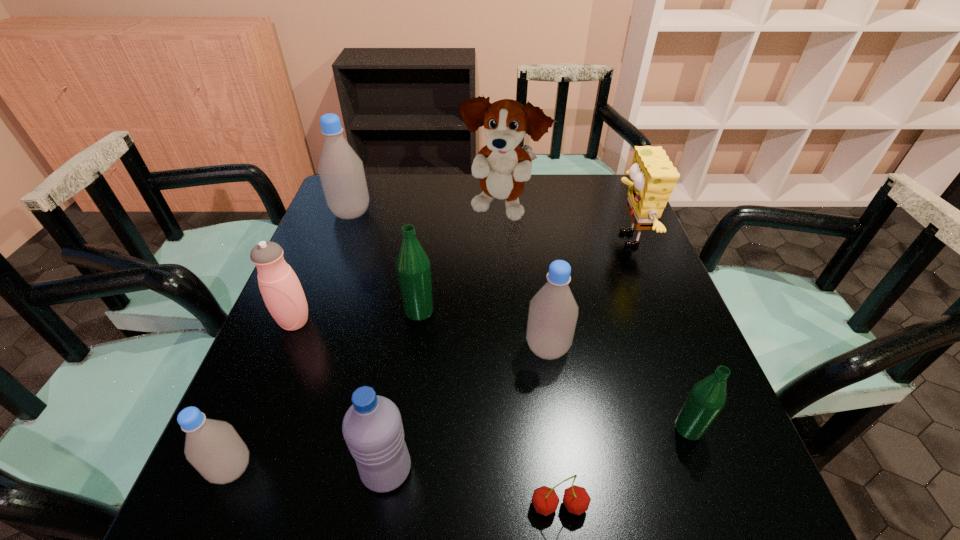
Image resolution: width=960 pixels, height=540 pixels. I want to click on vacant position at the left edge of the desktop, so click(339, 231).

Find the location of a particular element. This screenshot has width=960, height=540. free space at the right edge is located at coordinates (605, 293).

Where is `free region at the far left corner of the desktop`? free region at the far left corner of the desktop is located at coordinates (368, 182).

You are a GUI agent. You are given a task and a screenshot of the screen. Output one action in this format:
    pyautogui.click(x=<x>, y=<y>)
    Task: Click on the free space at the near left corner of the desktop
    
    Given the screenshot: What is the action you would take?
    pyautogui.click(x=214, y=524)

Find the location of a particular element. This screenshot has width=960, height=540. blank space at the far right corner is located at coordinates coord(600,176).

Find the location of `free space that is in between the seventh farthest object and the sponge`. free space that is in between the seventh farthest object and the sponge is located at coordinates (658, 334).

This screenshot has height=540, width=960. Identify the location of vacant area that lies between the biggest gray bottle and the cherry. (455, 360).

You are a GUI agent. You are given a task and a screenshot of the screen. Output one action in this format:
    pyautogui.click(x=<x>, y=<y>)
    Task: Click on the free space between the rightmost bottle and the second tallest object
    Image resolution: width=960 pixels, height=540 pixels.
    Given the screenshot: What is the action you would take?
    pyautogui.click(x=520, y=321)

Identify the location of vacant area that lies between the ninth shortest object and the cherry. point(455,360).

What are the coordinates of `unoccupied area between the yellow sponge and the nearest gray bottle` in the screenshot? It's located at (429, 354).